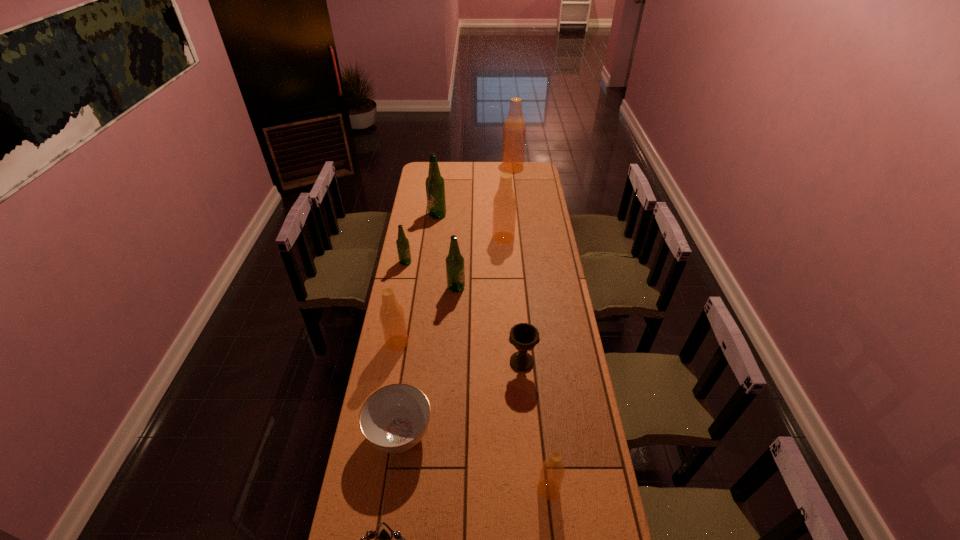
Identify the location of vacant position located 0.180m on the front of the third farthest beer bottle. (505, 267).

What are the coordinates of `vacant space situated 0.210m on the label of the sixth nearest object` in the screenshot? It's located at (510, 288).

What are the coordinates of `vacant region located on the right of the third biggest tan beer bottle` in the screenshot? It's located at (476, 343).

This screenshot has width=960, height=540. I want to click on free space located 0.240m on the label of the leftmost green beer bottle, so click(x=460, y=262).

At what (x,y) coordinates should I click in order to perform the action: click on vacant space located 0.090m on the back of the nearest beer bottle. Please return your answer as a coordinate pair (x, y). The image size is (960, 540). Looking at the image, I should click on (544, 451).

Where is `vacant space located 0.080m on the left of the chalice`? vacant space located 0.080m on the left of the chalice is located at coordinates (487, 362).

Where is `free point located on the front of the ninth tallest object`? Image resolution: width=960 pixels, height=540 pixels. free point located on the front of the ninth tallest object is located at coordinates (386, 530).

You are a GUI agent. You are given a task and a screenshot of the screen. Output one action in this format:
    pyautogui.click(x=<x>, y=<y>)
    Task: Click on the object positioned at the far edge
    The height and width of the screenshot is (540, 960).
    Given the screenshot: What is the action you would take?
    pyautogui.click(x=514, y=130)

Locate an element on the screen. chinaware present at the left edge is located at coordinates (393, 419).

Locate an element on the screen. Image resolution: width=960 pixels, height=540 pixels. object that is at the far right corner is located at coordinates (514, 130).